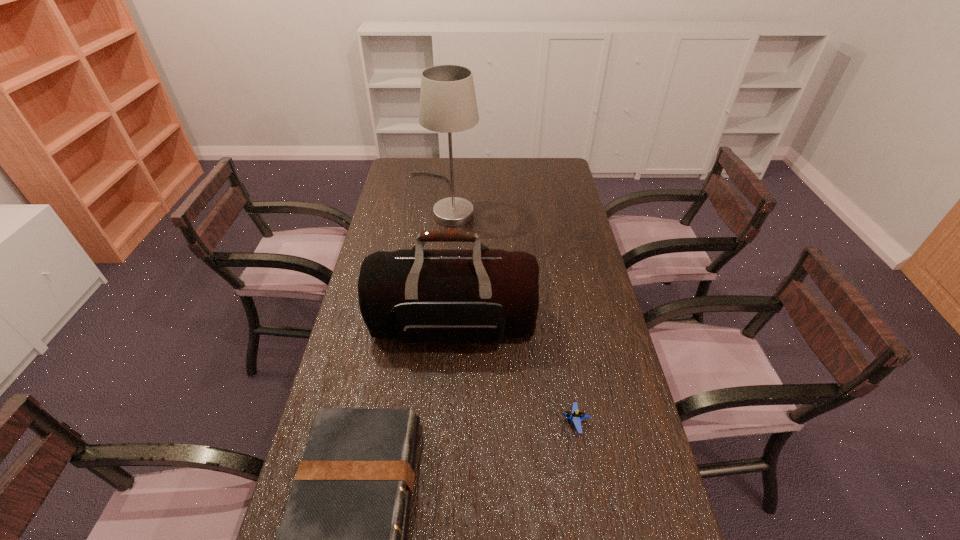
I want to click on the tallest object, so click(x=448, y=104).

I want to click on table lamp, so click(448, 104).

At what (x,y) coordinates should I click in order to perform the action: click on the third shortest object. Please return your answer as a coordinate pair (x, y). Looking at the image, I should click on (435, 296).

Identify the location of duffel bag. (435, 296).

Locate an element on the screen. The height and width of the screenshot is (540, 960). the rightmost object is located at coordinates pyautogui.click(x=576, y=416).

This screenshot has width=960, height=540. Find the location of `Lego`. Lego is located at coordinates (576, 416).

Image resolution: width=960 pixels, height=540 pixels. What are the coordinates of `vacant point located on the right of the farthest object` in the screenshot? It's located at (552, 200).

The image size is (960, 540). What are the coordinates of `vacant area situated on the front pocket of the third nearest object` in the screenshot? It's located at (446, 433).

Identify the location of vacant area located 0.360m on the front-facing side of the rightmost object. (425, 422).

Locate an element on the screen. Image resolution: width=960 pixels, height=540 pixels. vacant area situated on the front-facing side of the rightmost object is located at coordinates (411, 422).